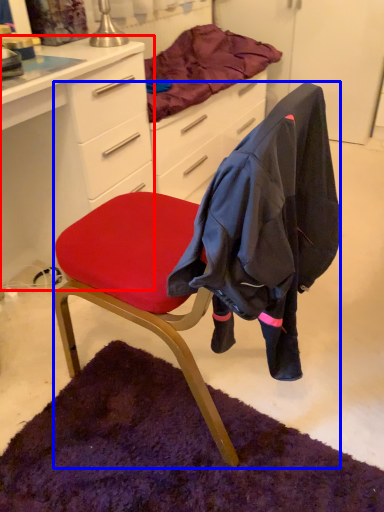
Question: Which object is further to the camera taking this photo, desk (highlighted by a red box) or chair (highlighted by a blue box)?

Choices:
 (A) desk
 (B) chair

Answer: (A)